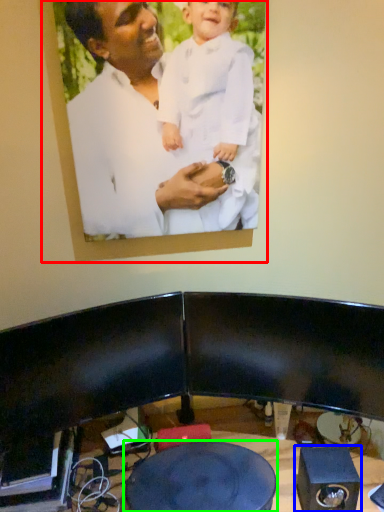
Question: Which object is the farthest from picture frame (highlighted by a red box)? Choose among these: speaker (highlighted by a blue box) or round table (highlighted by a green box).

Choices:
 (A) speaker
 (B) round table

Answer: (A)